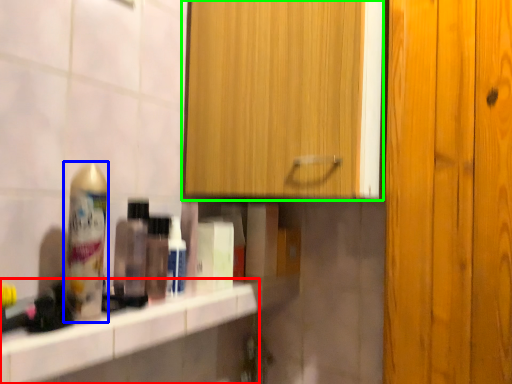
Question: Which is farther away from counter top (highlighted by a red box)? shaving cream (highlighted by a blue box) or cabinetry (highlighted by a green box)?

Choices:
 (A) shaving cream
 (B) cabinetry

Answer: (B)